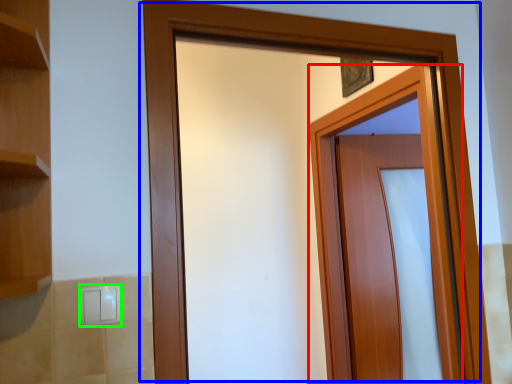
Question: Estimate the real-world distances between objects in this image. Which object is farther from door (highlighted by a red box), door (highlighted by a blue box) or light switch (highlighted by a green box)?

Choices:
 (A) door
 (B) light switch

Answer: (B)